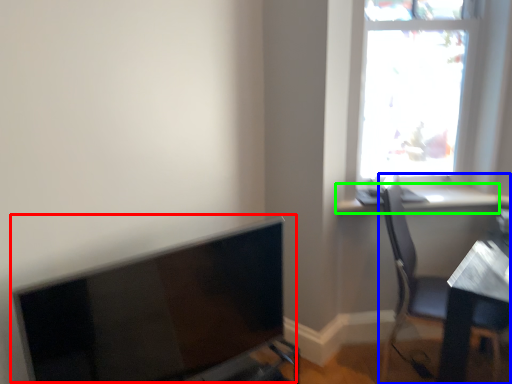
Question: Considering the real-world distances, which object is farthest from computer monitor (highlighted by a red box)? chair (highlighted by a blue box) or window sill (highlighted by a green box)?

Choices:
 (A) chair
 (B) window sill

Answer: (B)